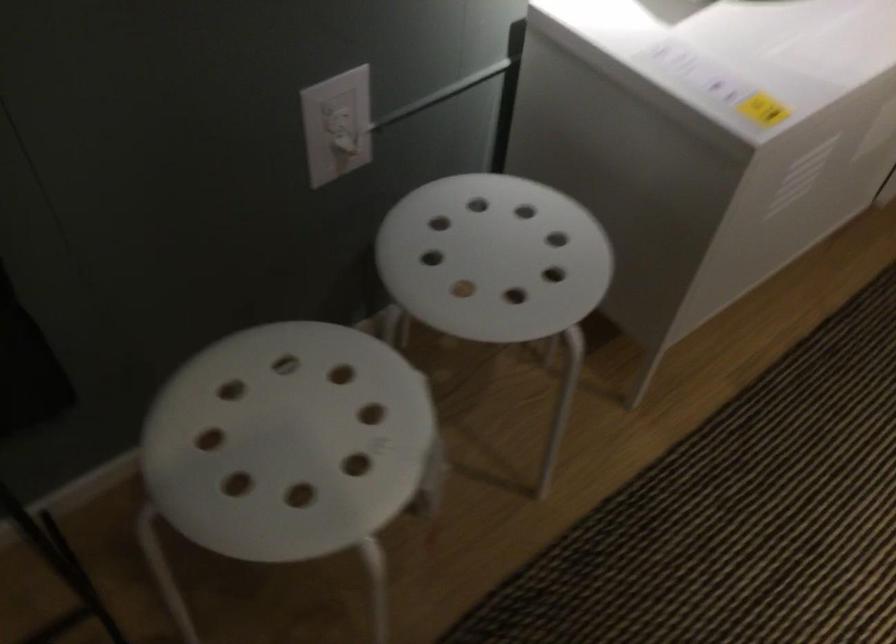
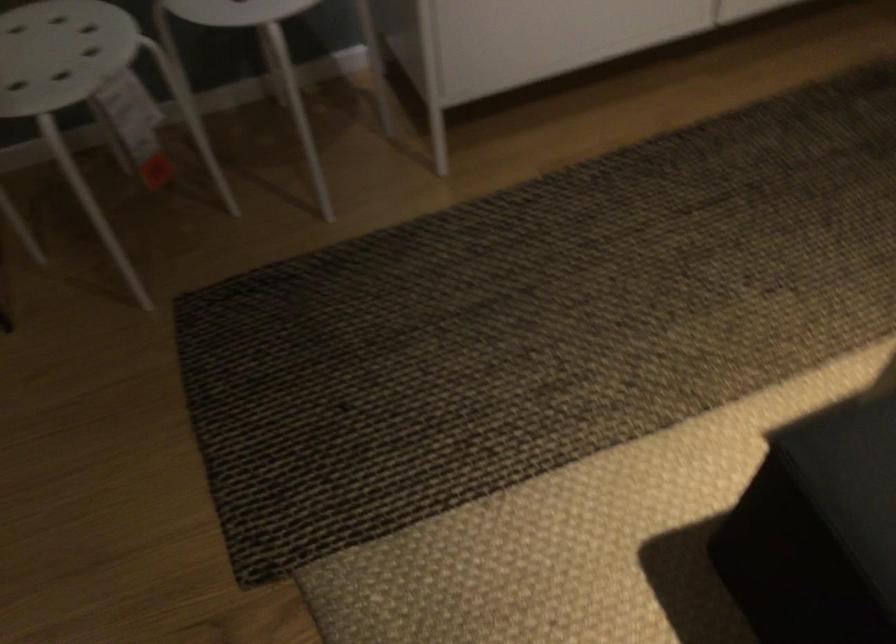
The point at (314, 417) is marked in the first image. Where is the corresponding point in the second image?

(61, 53)